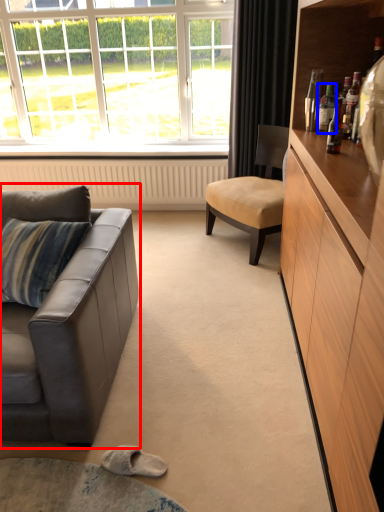
Question: Among these objects, which one is nearest to the camera, studio couch (highlighted by a red box) or bottle (highlighted by a blue box)?

Choices:
 (A) studio couch
 (B) bottle

Answer: (A)